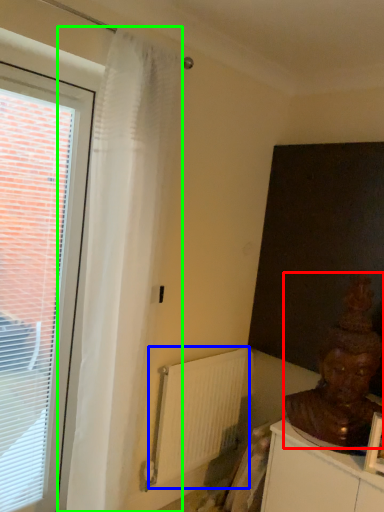
Question: Considering the real-world distances, which object is farthest from person (highlighted by a red box)? radiator (highlighted by a blue box) or curtain (highlighted by a green box)?

Choices:
 (A) radiator
 (B) curtain

Answer: (B)